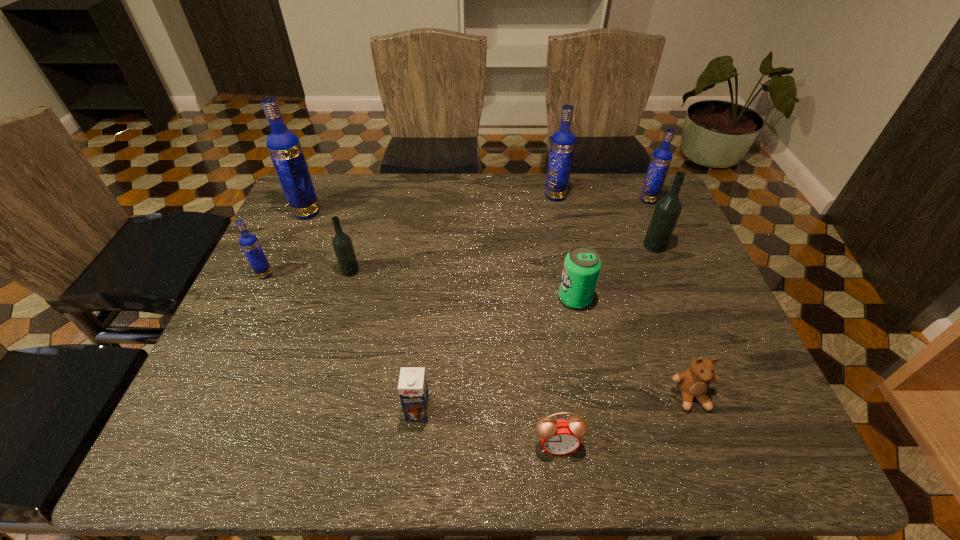
Identify the location of vacant area that lies between the third biggest blue vodka and the second tallest vodka. The image size is (960, 540). (602, 198).

Identify the location of unoccupied area between the tallest object and the third blue vodka from left to right. (431, 204).

Locate an element on the screen. Image resolution: width=960 pixels, height=540 pixels. blank region between the brown teddy bear and the seventh nearest object is located at coordinates (673, 321).

Locate an element on the screen. free space between the second smallest blue vodka and the pop soda is located at coordinates (612, 249).

Identify which object is the eighth closest to the second blue vodka from right to left. Please provide its 2D coordinates. Your answer should be formatted as a tuple, i.e. [(x, y)], where the tuple contains the x and y coordinates of a point satisfying the conditions above.

[(559, 437)]

Identify the location of the sixth closest object to the biggest blue vodka. (559, 437).

Find the location of a particular element. The width and height of the screenshot is (960, 540). the second closest vodka to the left black vodka is located at coordinates (284, 147).

Identify which vodka is the fifth nearest to the biggest blue vodka. Please provide its 2D coordinates. Your answer should be formatted as a tuple, i.e. [(x, y)], where the tuple contains the x and y coordinates of a point satisfying the conditions above.

[(661, 159)]

This screenshot has height=540, width=960. In order to click on blue vodka that is the fourth closest to the right black vodka in this screenshot , I will do `click(249, 243)`.

The height and width of the screenshot is (540, 960). Identify the location of blue vodka object that ranks as the third closest to the seventh object from right to left. (562, 145).